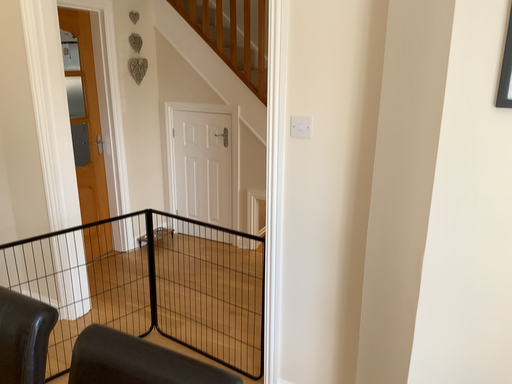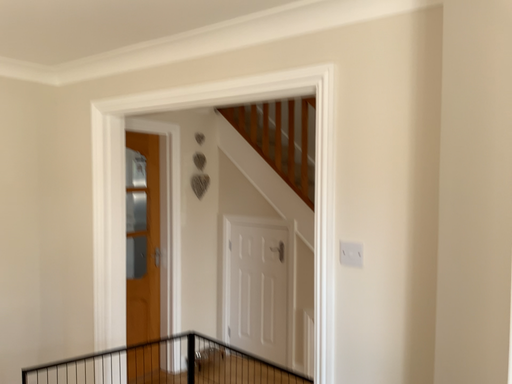
Question: How did the camera likely rotate when shooting the video?

Choices:
 (A) rotated upward
 (B) rotated downward

Answer: (A)